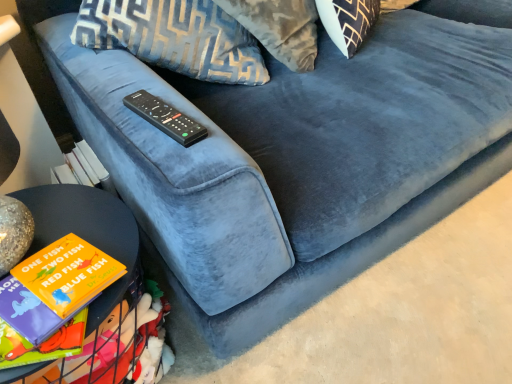
Question: Considering the positions of black plastic remote at center and matte black table at lower left in the image, is black plastic remote at center taller or shorter than matte black table at lower left?

Choices:
 (A) short
 (B) tall

Answer: (A)

Question: In terms of size, does black plastic remote at center appear bigger or smaller than matte black table at lower left?

Choices:
 (A) small
 (B) big

Answer: (A)

Question: From the image's perspective, is black plastic remote at center positioned above or below matte black table at lower left?

Choices:
 (A) below
 (B) above

Answer: (B)

Question: Is matte black table at lower left inside or outside of black plastic remote at center?

Choices:
 (A) inside
 (B) outside

Answer: (B)

Question: Does point (84, 215) appear closer or farther from the camera than point (151, 104)?

Choices:
 (A) closer
 (B) farther

Answer: (B)

Question: Would you say matte black table at lower left is to the left or to the right of black plastic remote at center in the picture?

Choices:
 (A) right
 (B) left

Answer: (B)

Question: Considering their positions, is matte black table at lower left located in front of or behind black plastic remote at center?

Choices:
 (A) front
 (B) behind

Answer: (A)